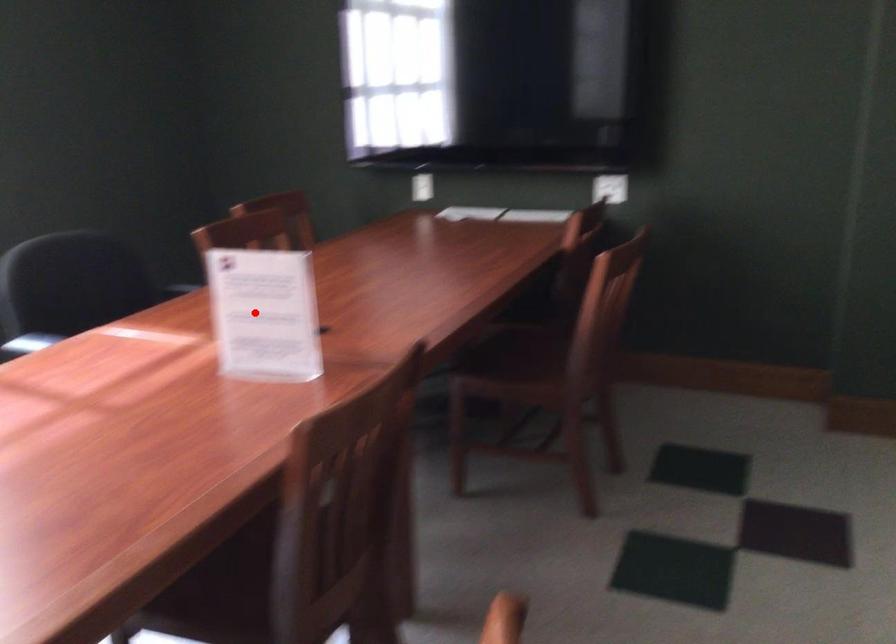
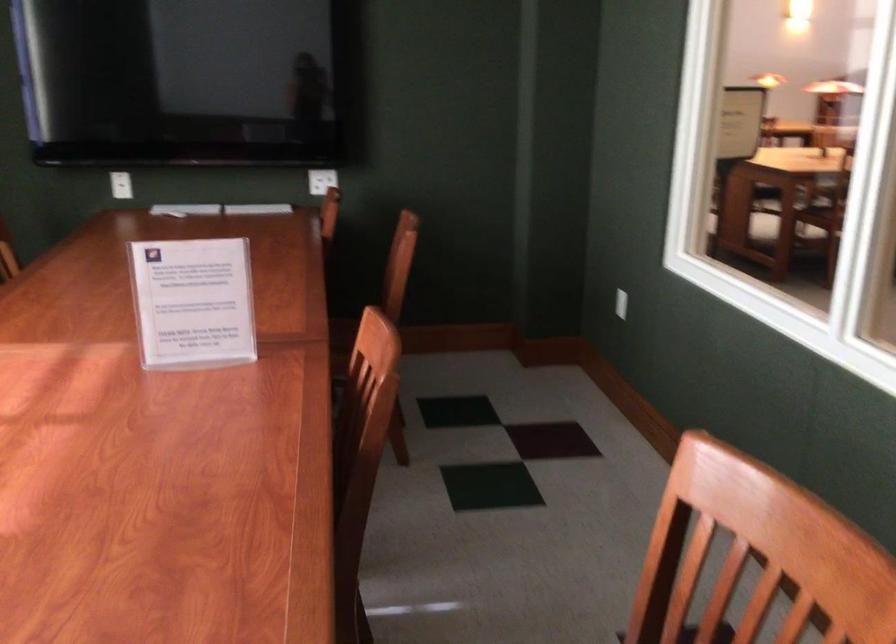
In the second image, find the point that corresponds to the highlighted location in the first image.

(193, 303)